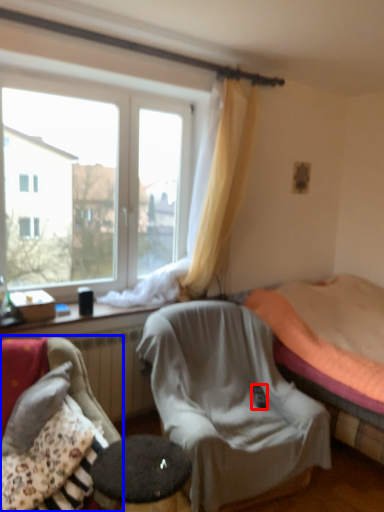
Question: Which object is closer to the camera taking this photo, remote control (highlighted by a red box) or chair (highlighted by a blue box)?

Choices:
 (A) remote control
 (B) chair

Answer: (B)